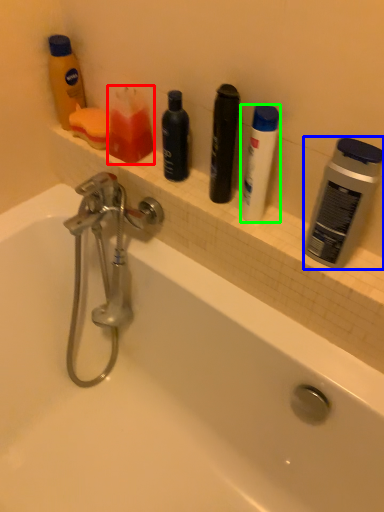
Question: Estimate the real-world distances between objects in this image. Which object is closer to toiletry (highlighted by a red box), personal care (highlighted by a blue box) or toiletry (highlighted by a green box)?

Choices:
 (A) personal care
 (B) toiletry

Answer: (B)